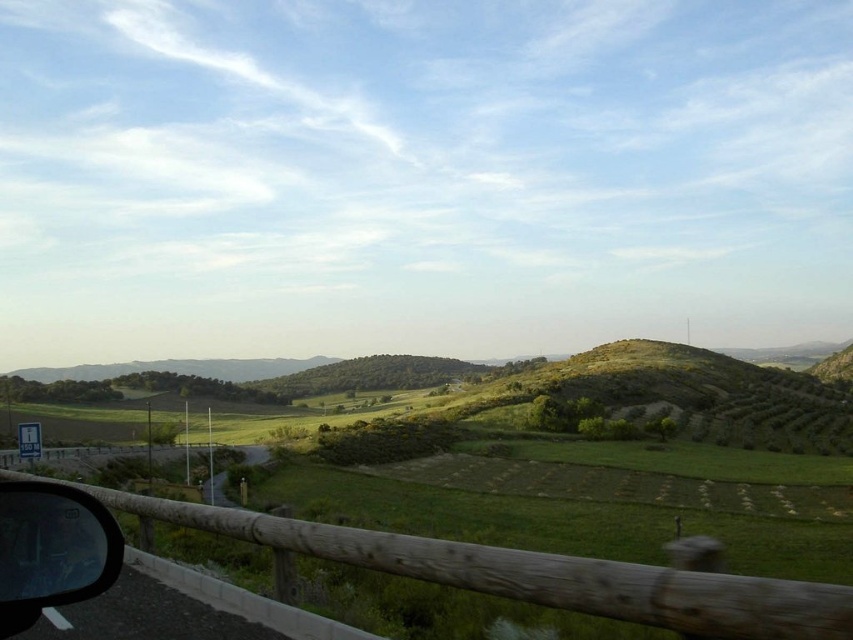
You are a passenger in a car and want to observe the rural landscape outside. Which object, the wooden at lower center or the transparent glass car window at lower left, would allow you to see more of the view outside the car?

The wooden at lower center has a larger size compared to the transparent glass car window at lower left, so it would allow you to see more of the view outside the car.

You are sitting in the car and looking out the window. There is a wooden object located at a specific coordinate point in the scene. Can you tell me what is at point (532, 573) in the image?

At point (532, 573) lies wooden at lower center.